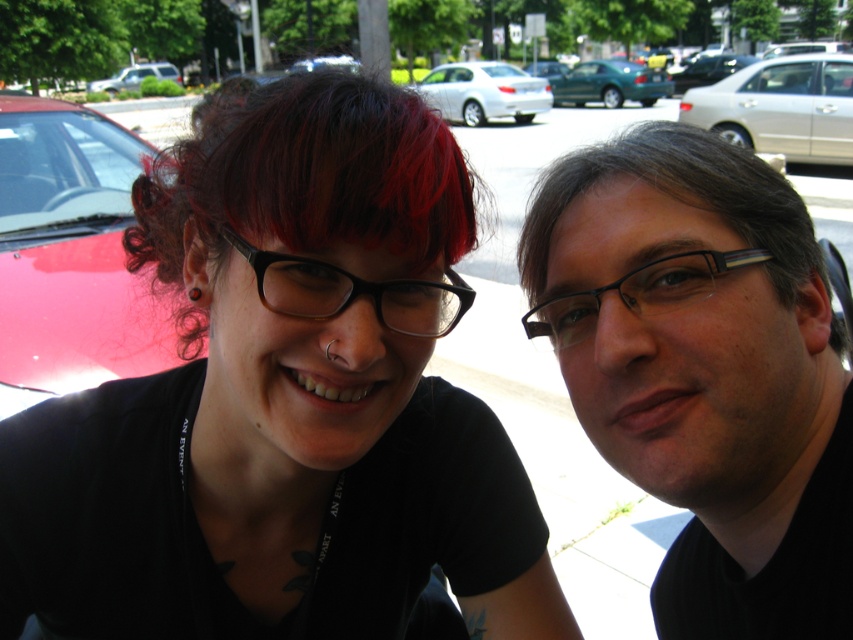
You are a photographer trying to capture both the gray matte hair at upper right and the silver metallic sedan at center in a single frame. Given their sizes, which object should you focus on first to ensure both fit in the photo?

The gray matte hair at upper right is smaller in size compared to the silver metallic sedan at center, so you should focus on the silver metallic sedan at center first to ensure both fit in the photo.

You are a photographer trying to focus on the shiny red hair at center and the black plastic glasses at center. Which object should you adjust your camera focus on first if you want to capture both clearly?

You should focus on the shiny red hair at center first because it is closer to the viewer than the black plastic glasses at center, ensuring both are in focus when using a shallow depth of field.